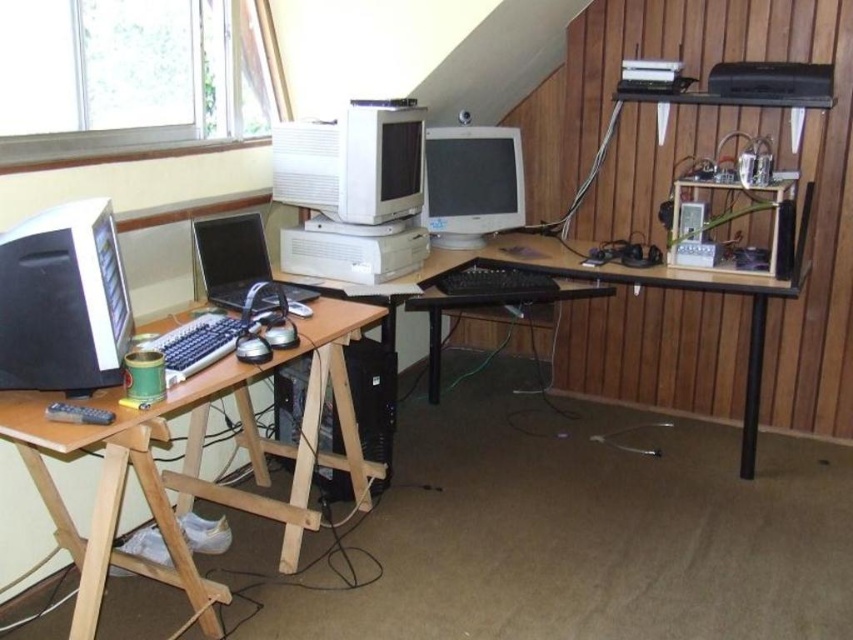
Looking at this image, you are setting up a new cable connection between the matte gray monitor at center and the black plastic printer at upper right. Which device should you plug the cable into first if you want to avoid having to move either device?

The matte gray monitor at center is located below the black plastic printer at upper right. Since the cable needs to connect both devices, you should plug one end into the matte gray monitor at center first, then route the cable upwards to the black plastic printer at upper right without needing to move either device.

You are standing in the workspace and want to reach the matte gray monitor at center. The maximum reach distance for you is 3 meters. Can you comfortably reach it without moving your position?

The matte gray monitor at center is 3.13 meters away from viewer, so you cannot comfortably reach it without moving your position since it exceeds your maximum reach distance of 3 meters.